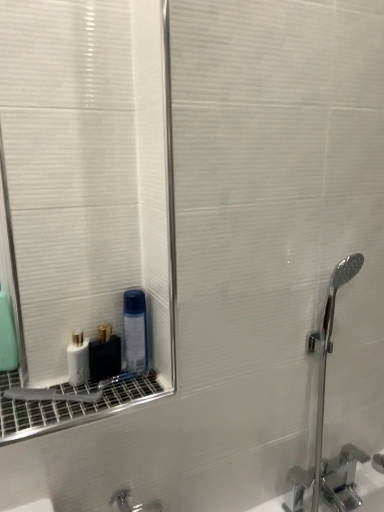
Question: Is chrome metallic faucet at right in contact with white glossy bottle at lower left, which appears as the 3th mouthwash when viewed from the left?

Choices:
 (A) no
 (B) yes

Answer: (A)

Question: Is white glossy bottle at lower left, which is the second mouthwash from right to left, completely or partially inside chrome metallic faucet at right?

Choices:
 (A) no
 (B) yes

Answer: (A)

Question: From a real-world perspective, is chrome metallic faucet at right physically above white glossy bottle at lower left, which is the second mouthwash from right to left?

Choices:
 (A) yes
 (B) no

Answer: (B)

Question: Considering the relative sizes of chrome metallic faucet at right and white glossy bottle at lower left, which is the second mouthwash from right to left, in the image provided, is chrome metallic faucet at right taller than white glossy bottle at lower left, which is the second mouthwash from right to left,?

Choices:
 (A) yes
 (B) no

Answer: (A)

Question: Does chrome metallic faucet at right come behind white glossy bottle at lower left, which appears as the 3th mouthwash when viewed from the left?

Choices:
 (A) yes
 (B) no

Answer: (B)

Question: Does chrome metallic faucet at right have a lesser height compared to white glossy bottle at lower left, which is the second mouthwash from right to left?

Choices:
 (A) no
 (B) yes

Answer: (A)

Question: Is white glossy bottle at lower left, which appears as the 3th mouthwash when viewed from the left, next to white glossy bottle at lower left, placed as the third mouthwash when sorted from right to left, and touching it?

Choices:
 (A) no
 (B) yes

Answer: (B)

Question: Is white glossy bottle at lower left, which appears as the 3th mouthwash when viewed from the left, at the right side of white glossy bottle at lower left, placed as the third mouthwash when sorted from right to left?

Choices:
 (A) no
 (B) yes

Answer: (B)

Question: Is white glossy bottle at lower left, which is the second mouthwash from right to left, further to the viewer compared to white glossy bottle at lower left, the second mouthwash from the left?

Choices:
 (A) yes
 (B) no

Answer: (A)

Question: Considering the relative sizes of white glossy bottle at lower left, which is the second mouthwash from right to left, and white glossy bottle at lower left, placed as the third mouthwash when sorted from right to left, in the image provided, is white glossy bottle at lower left, which is the second mouthwash from right to left, wider than white glossy bottle at lower left, placed as the third mouthwash when sorted from right to left,?

Choices:
 (A) no
 (B) yes

Answer: (B)

Question: Is white glossy bottle at lower left, which is the second mouthwash from right to left, outside white glossy bottle at lower left, the second mouthwash from the left?

Choices:
 (A) yes
 (B) no

Answer: (A)

Question: Considering the relative sizes of white glossy bottle at lower left, which appears as the 3th mouthwash when viewed from the left, and white glossy bottle at lower left, placed as the third mouthwash when sorted from right to left, in the image provided, is white glossy bottle at lower left, which appears as the 3th mouthwash when viewed from the left, shorter than white glossy bottle at lower left, placed as the third mouthwash when sorted from right to left,?

Choices:
 (A) yes
 (B) no

Answer: (A)

Question: Could you tell me if white glossy bottle at lower left, which appears as the 3th mouthwash when viewed from the left, is turned towards green matte mouthwash at left, arranged as the 4th mouthwash when viewed from the right?

Choices:
 (A) no
 (B) yes

Answer: (A)